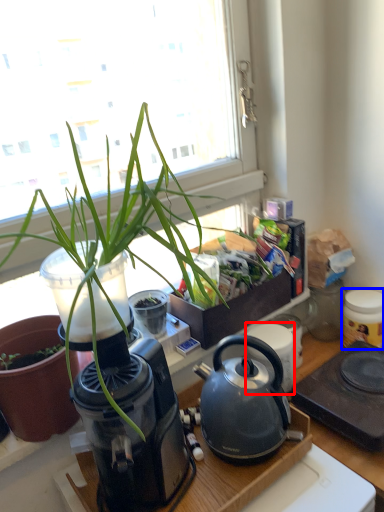
Question: Which point is closer to the camera, appliance (highlighted by a red box) or appliance (highlighted by a blue box)?

Choices:
 (A) appliance
 (B) appliance

Answer: (A)